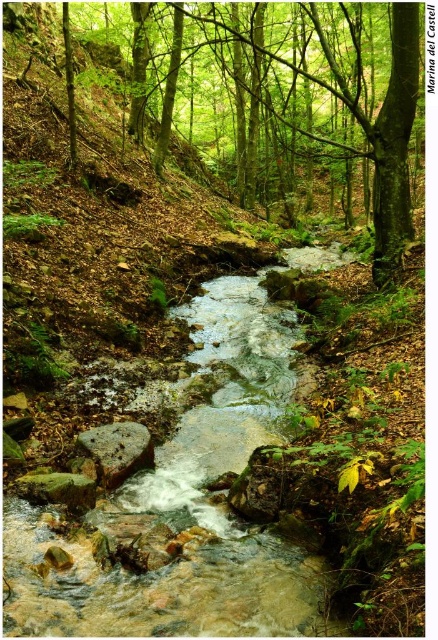
Question: Is green leafy tree at center smaller than smooth gray rock at center?

Choices:
 (A) yes
 (B) no

Answer: (B)

Question: Which point is farther to the camera?

Choices:
 (A) green leafy tree at center
 (B) smooth gray rock at center

Answer: (B)

Question: Does green leafy tree at center have a smaller size compared to smooth gray rock at center?

Choices:
 (A) no
 (B) yes

Answer: (A)

Question: Does green leafy tree at center have a greater width compared to smooth gray rock at center?

Choices:
 (A) yes
 (B) no

Answer: (A)